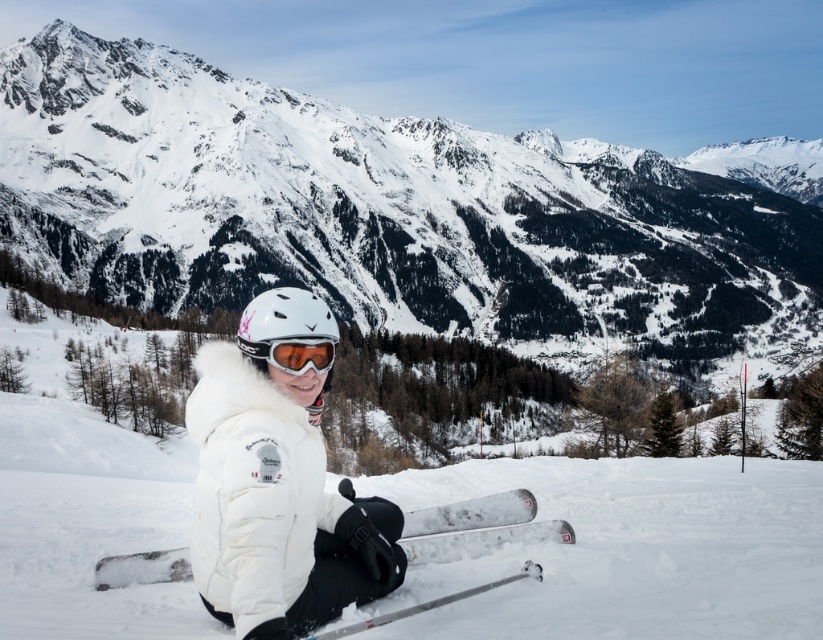
Question: Among these points, which one is nearest to the camera?

Choices:
 (A) (143, 563)
 (B) (475, 332)
 (C) (305, 368)

Answer: (C)

Question: Considering the real-world distances, which object is farthest from the silver metallic ski at lower center?

Choices:
 (A) snowy mountain at center
 (B) orange reflective lens goggles at center

Answer: (A)

Question: Does snowy mountain at center lie in front of silver metallic ski at lower center?

Choices:
 (A) no
 (B) yes

Answer: (A)

Question: Can you confirm if snowy mountain at center is wider than orange reflective lens goggles at center?

Choices:
 (A) yes
 (B) no

Answer: (A)

Question: Does snowy mountain at center lie behind silver metallic ski at lower center?

Choices:
 (A) yes
 (B) no

Answer: (A)

Question: Which object is farther from the camera taking this photo?

Choices:
 (A) silver metallic ski at lower center
 (B) snowy mountain at center
 (C) orange reflective lens goggles at center

Answer: (B)